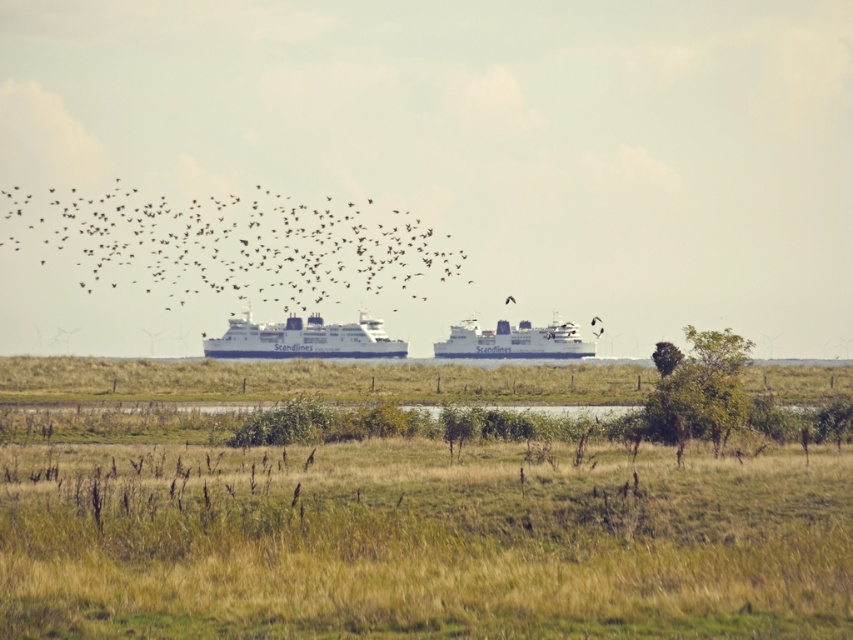
You are an observer standing in the field. You see the white matte ferry at center and the dark brown feathered bird at upper center. Which object is bigger?

The white matte ferry at center is larger than the dark brown feathered bird at upper center.

You are a birdwatcher observing the scene from a distance. You see the white matte ferry at center and the dark brown feathered bird at upper center. Which object is taller?

The white matte ferry at center is taller than the dark brown feathered bird at upper center according to the description.